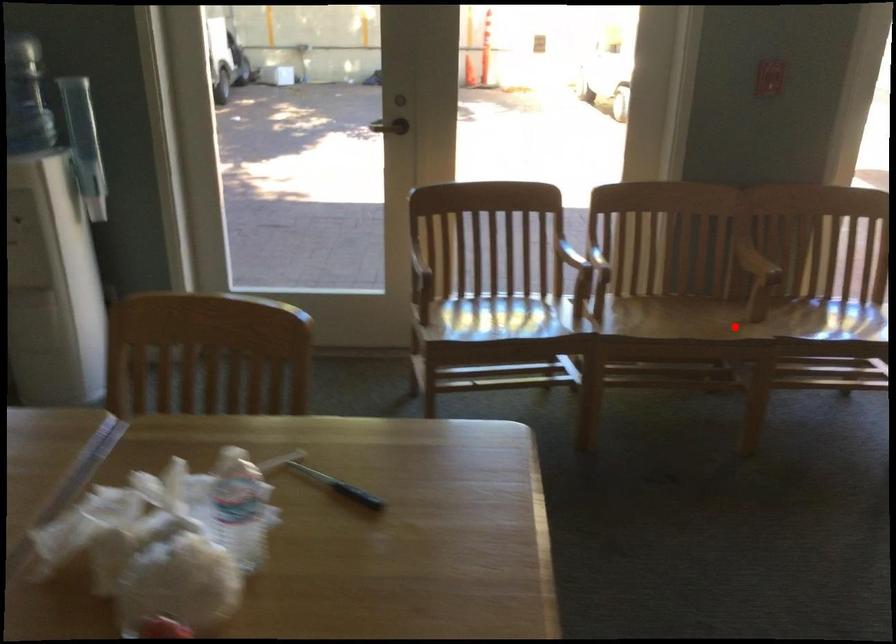
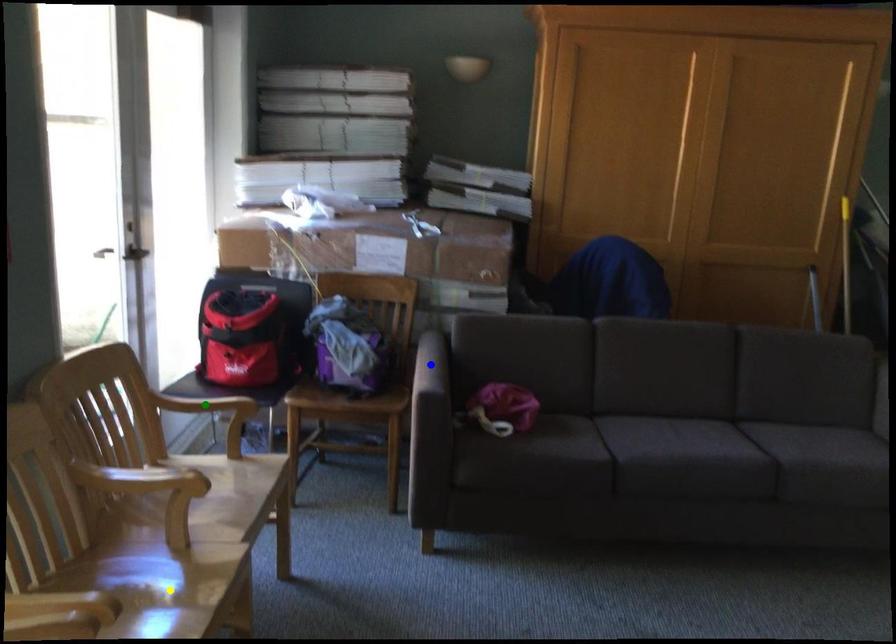
Question: I am providing you with two images of the same scene from different viewpoints. A red point is marked on the first image. You are given multiple points on the second image. In image 2, which mark is for the same physical point as the one in image 1?

Choices:
 (A) green point
 (B) blue point
 (C) yellow point

Answer: (C)